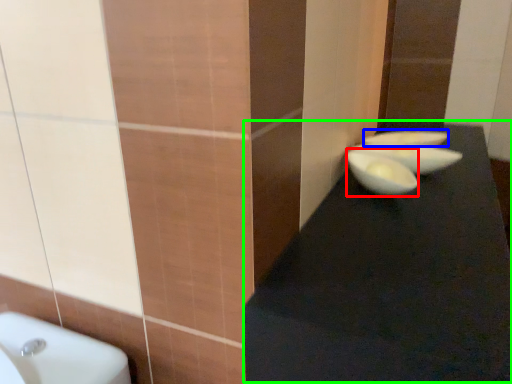
Question: Which object is the farthest from glass bowl (highlighted by a red box)? Choose among these: basin (highlighted by a blue box) or table top (highlighted by a green box).

Choices:
 (A) basin
 (B) table top

Answer: (A)